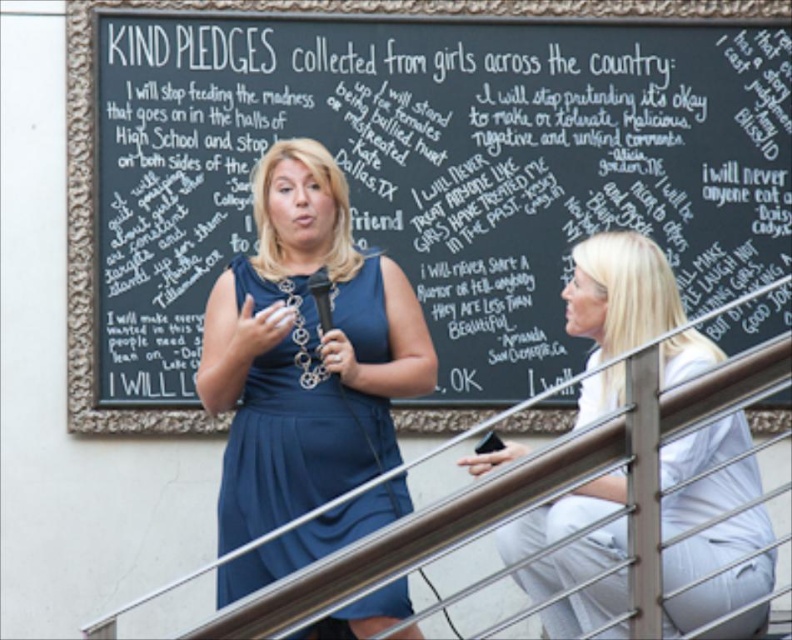
Question: Which point is farther from the camera taking this photo?

Choices:
 (A) (109, 625)
 (B) (676, 502)

Answer: (B)

Question: Where is white fabric blouse at right located in relation to metallic silver railing at center in the image?

Choices:
 (A) right
 (B) left

Answer: (A)

Question: Is white fabric blouse at right smaller than black chalkboard at upper center?

Choices:
 (A) yes
 (B) no

Answer: (B)

Question: Estimate the real-world distances between objects in this image. Which object is closer to the metallic silver railing at center?

Choices:
 (A) black chalkboard at upper center
 (B) matte blue dress at center

Answer: (A)

Question: Does matte blue dress at center appear over metallic silver railing at center?

Choices:
 (A) yes
 (B) no

Answer: (B)

Question: Which point is closer to the camera?

Choices:
 (A) (522, 420)
 (B) (680, 344)
 (C) (436, 454)

Answer: (B)